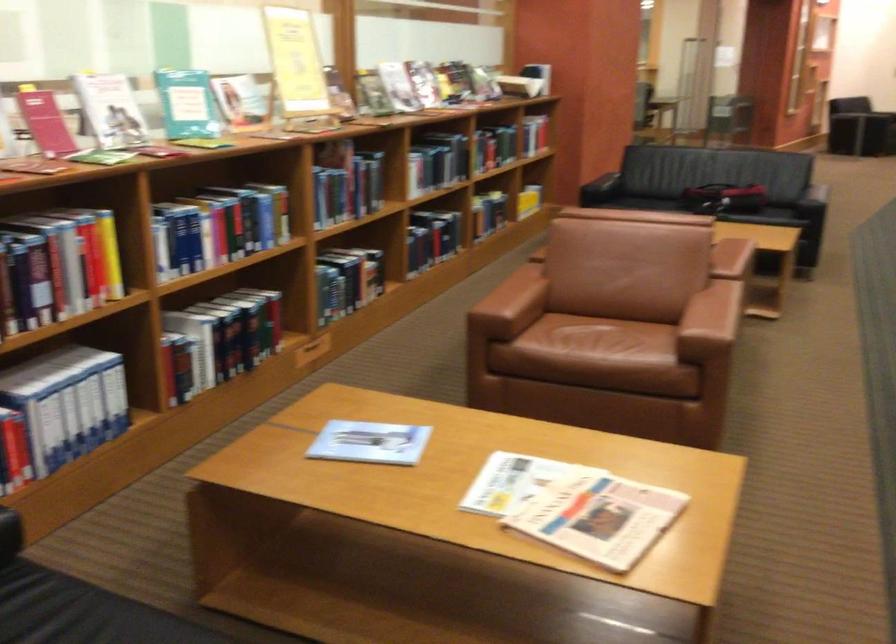
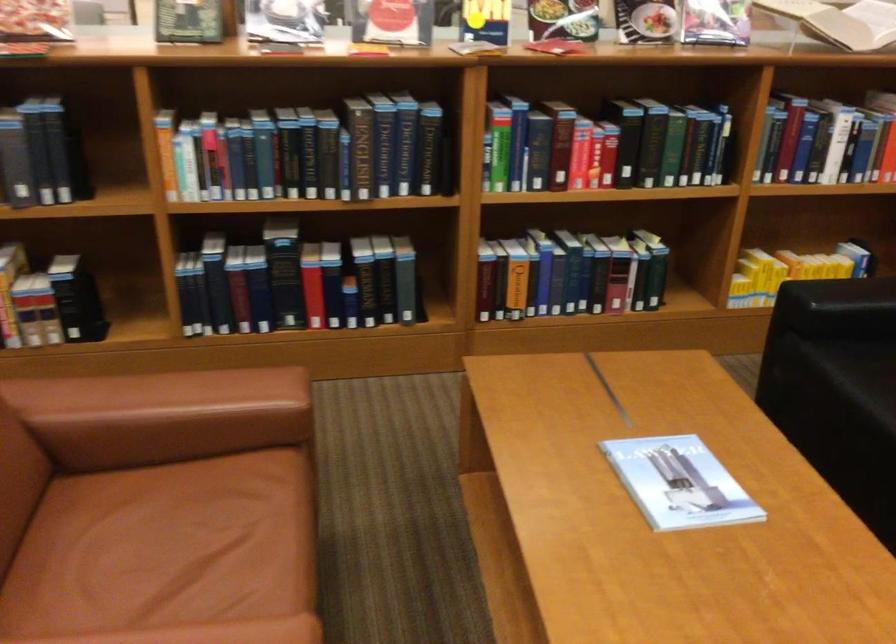
Where in the second image is the point corresponding to [443,161] from the first image?

(306, 152)